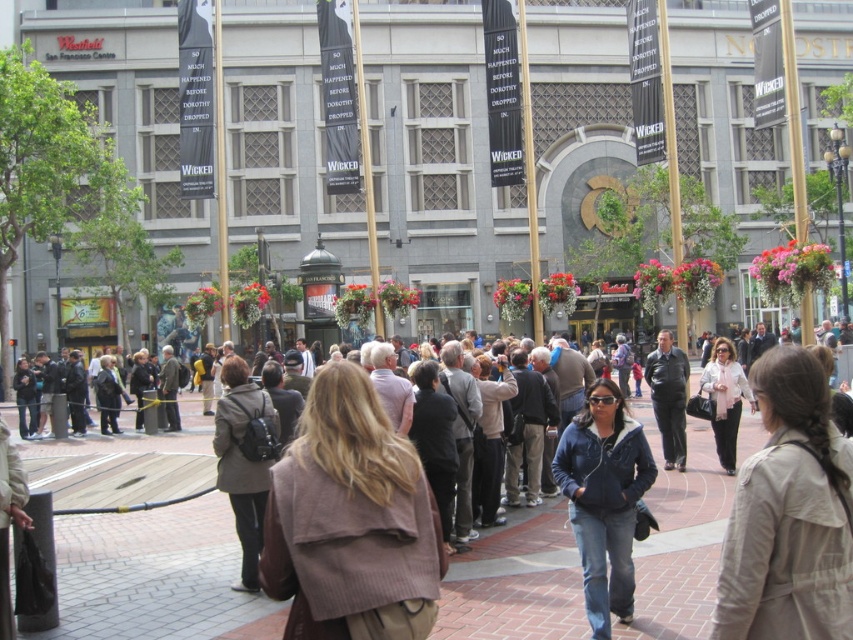
Question: Which point is farther to the camera?

Choices:
 (A) brown textured coat at center
 (B) brown leather jacket at center
 (C) dark brown leather jacket at center

Answer: (C)

Question: Does brown leather jacket at center appear over light pink scarf at center?

Choices:
 (A) yes
 (B) no

Answer: (B)

Question: Which object is positioned closest to the denim jacket at center?

Choices:
 (A) light pink scarf at center
 (B) light beige coat at center
 (C) brown leather jacket at center
 (D) brown textured coat at center

Answer: (B)

Question: Does brown leather jacket at center have a larger size compared to dark brown leather jacket at center?

Choices:
 (A) no
 (B) yes

Answer: (A)

Question: Does denim jacket at center have a smaller size compared to dark brown leather jacket at center?

Choices:
 (A) yes
 (B) no

Answer: (A)

Question: Among these objects, which one is farthest from the camera?

Choices:
 (A) brown textured coat at center
 (B) light beige coat at center
 (C) brown leather jacket at center
 (D) dark brown leather jacket at center

Answer: (D)